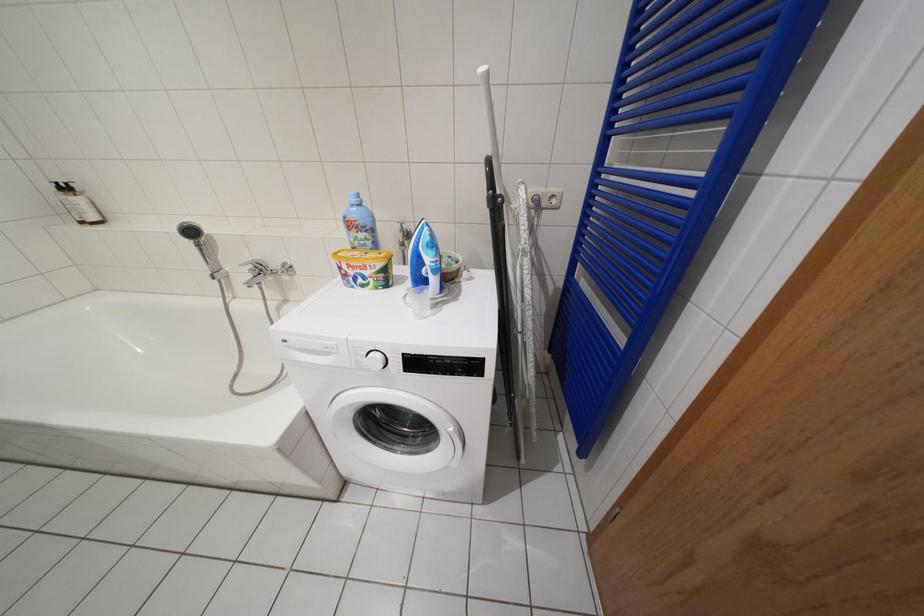
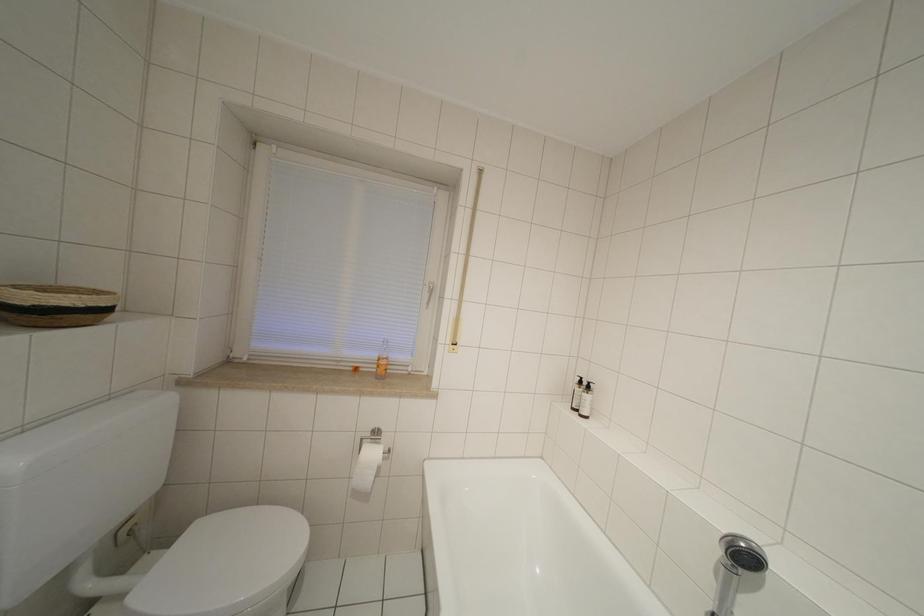
Question: How did the camera likely rotate?

Choices:
 (A) Left
 (B) Right
 (C) Up
 (D) Down

Answer: (A)